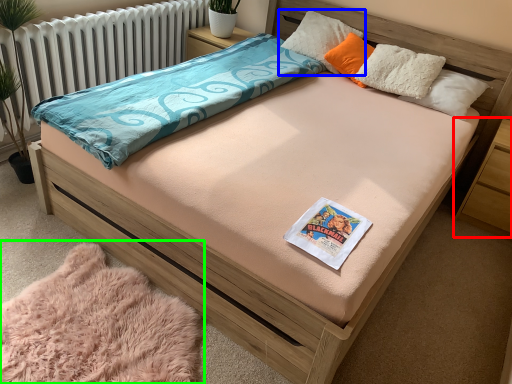
Question: Considering the real-world distances, which object is farthest from nightstand (highlighted by a red box)? pillow (highlighted by a blue box) or blanket (highlighted by a green box)?

Choices:
 (A) pillow
 (B) blanket

Answer: (B)